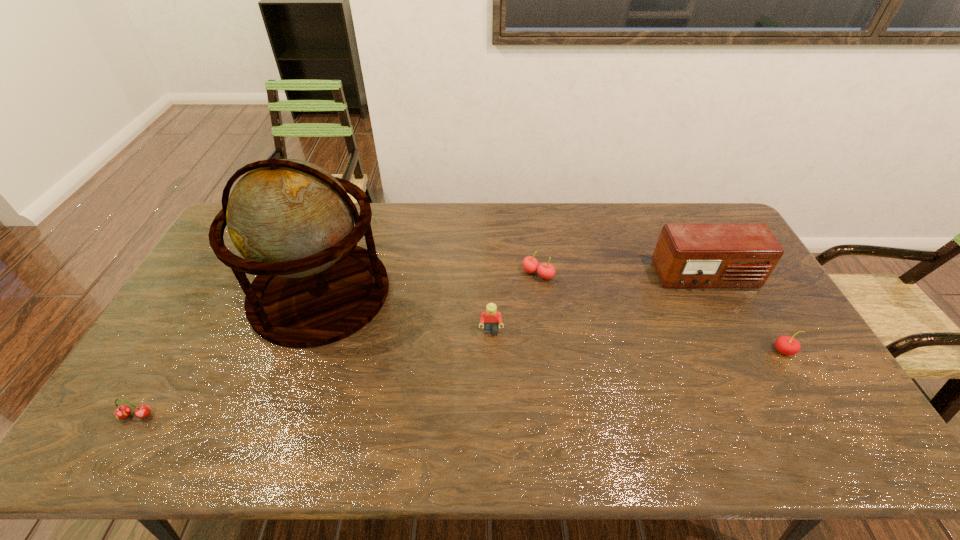
What are the coordinates of `vacant point located between the Lego and the radio receiver` in the screenshot? It's located at (598, 304).

What are the coordinates of `vacant space that's between the fifth shortest object and the second nearest cherry` in the screenshot? It's located at (745, 314).

Point out which object is positioned as the second nearest to the second tallest object. Please provide its 2D coordinates. Your answer should be formatted as a tuple, i.e. [(x, y)], where the tuple contains the x and y coordinates of a point satisfying the conditions above.

[(530, 264)]

The height and width of the screenshot is (540, 960). In order to click on the fifth closest object to the tallest object in this screenshot , I will do `click(786, 345)`.

Identify which cherry is the nearest to the leftmost cherry. Please provide its 2D coordinates. Your answer should be formatted as a tuple, i.e. [(x, y)], where the tuple contains the x and y coordinates of a point satisfying the conditions above.

[(530, 264)]

The image size is (960, 540). Identify the location of cherry that is the second closest one to the fifth shortest object. (530, 264).

The height and width of the screenshot is (540, 960). I want to click on free space that satisfies the following two spatial constraints: 1. on the front-facing side of the tallest object; 2. on the back side of the rightmost cherry, so click(x=300, y=351).

You are a GUI agent. You are given a task and a screenshot of the screen. Output one action in this format:
    pyautogui.click(x=<x>, y=<y>)
    Task: Click on the blank area in the image that satisfies the following two spatial constraints: 1. on the face of the second nearest cherry; 2. on the left side of the Lego
    
    Given the screenshot: What is the action you would take?
    pyautogui.click(x=492, y=351)

At what (x,y) coordinates should I click in order to perform the action: click on free space that satisfies the following two spatial constraints: 1. on the front-facing side of the second tallest object; 2. on the front-facing side of the tallest object. Please return your answer as a coordinate pair (x, y). The width and height of the screenshot is (960, 540). Looking at the image, I should click on (714, 293).

What are the coordinates of `vacant point that satisfies the following two spatial constraints: 1. on the back side of the rightmost cherry; 2. on the front-facing side of the globe` in the screenshot? It's located at (749, 293).